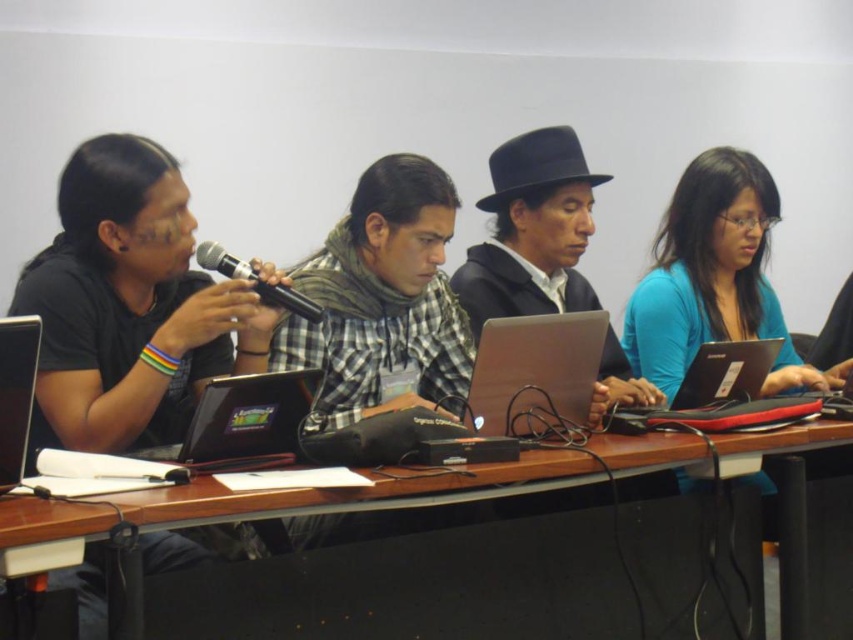
Question: Is shiny black laptop at center positioned at the back of black plastic laptop at lower right?

Choices:
 (A) no
 (B) yes

Answer: (A)

Question: Considering the real-world distances, which object is farthest from the black matte shirt at left?

Choices:
 (A) silver metallic laptop at center
 (B) wooden table at center
 (C) checkered fabric scarf at center
 (D) black plastic laptop at lower right

Answer: (D)

Question: Which object is the farthest from the black matte shirt at left?

Choices:
 (A) wooden table at center
 (B) matte black laptop at left
 (C) black matte microphone at center

Answer: (A)

Question: Can you confirm if black plastic laptop at lower right is positioned below matte black laptop at left?

Choices:
 (A) yes
 (B) no

Answer: (A)

Question: Does black felt hat at center appear on the left side of matte black laptop at left?

Choices:
 (A) no
 (B) yes

Answer: (A)

Question: Which of the following is the closest to the observer?

Choices:
 (A) silver metallic laptop at center
 (B) blue matte shirt at right
 (C) wooden table at center
 (D) black matte shirt at left

Answer: (C)